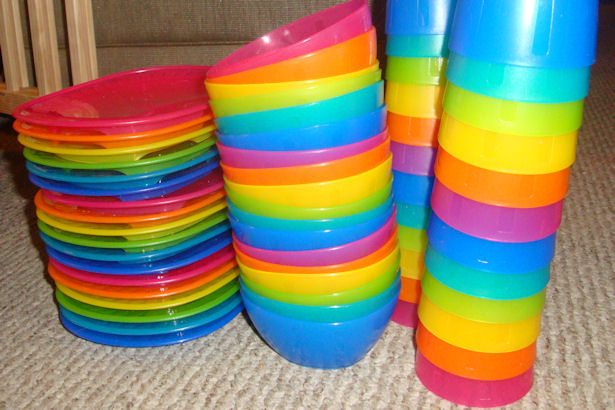
In order to click on bowls in this screenshot , I will do `click(312, 178)`.